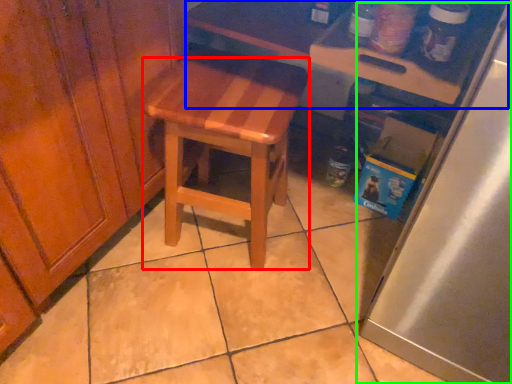
Question: Which object is positioned closest to stool (highlighted by a red box)? Select from table (highlighted by a blue box) and appliance (highlighted by a green box).

Choices:
 (A) table
 (B) appliance

Answer: (A)